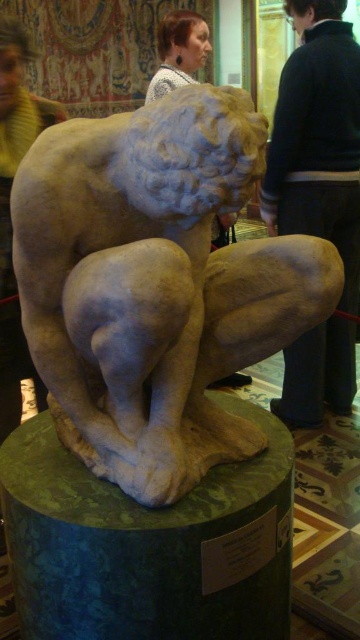
Question: Is green marble pedestal at center below light brown hair at upper center?

Choices:
 (A) yes
 (B) no

Answer: (A)

Question: Is dark blue sweater at upper center positioned at the back of light brown hair at upper center?

Choices:
 (A) no
 (B) yes

Answer: (A)

Question: Is white marble statue at center closer to camera compared to green marble pedestal at center?

Choices:
 (A) no
 (B) yes

Answer: (B)

Question: Among these objects, which one is farthest from the camera?

Choices:
 (A) dark blue sweater at upper center
 (B) light brown hair at upper center
 (C) green marble pedestal at center

Answer: (B)

Question: Which object is the closest to the green marble pedestal at center?

Choices:
 (A) white marble statue at center
 (B) light brown hair at upper center
 (C) dark blue sweater at upper center

Answer: (A)

Question: Estimate the real-world distances between objects in this image. Which object is farther from the dark blue sweater at upper center?

Choices:
 (A) green marble pedestal at center
 (B) light brown hair at upper center
 (C) white marble statue at center

Answer: (A)